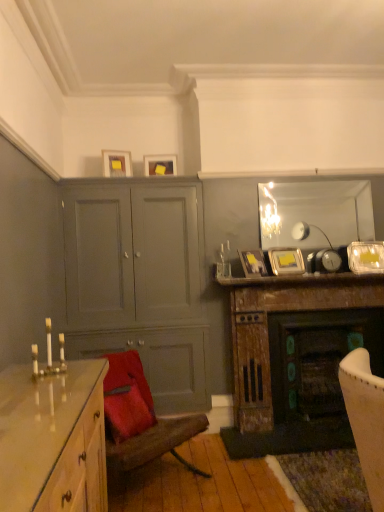
Question: Is metallic silver picture frame at upper right, which ranks as the fifth picture frame in left-to-right order, in front of matte yellow picture frame at upper center, which is the first picture frame in left-to-right order?

Choices:
 (A) yes
 (B) no

Answer: (A)

Question: From a real-world perspective, does metallic silver picture frame at upper right, the third picture frame positioned from the bottom, stand above matte yellow picture frame at upper center, which is the first picture frame in top-to-bottom order?

Choices:
 (A) no
 (B) yes

Answer: (A)

Question: Considering the relative sizes of metallic silver picture frame at upper right, the third picture frame positioned from the bottom, and matte yellow picture frame at upper center, placed as the 5th picture frame when sorted from right to left, in the image provided, is metallic silver picture frame at upper right, the third picture frame positioned from the bottom, bigger than matte yellow picture frame at upper center, placed as the 5th picture frame when sorted from right to left,?

Choices:
 (A) yes
 (B) no

Answer: (A)

Question: Is metallic silver picture frame at upper right, the third picture frame positioned from the bottom, thinner than matte yellow picture frame at upper center, placed as the 5th picture frame when sorted from right to left?

Choices:
 (A) no
 (B) yes

Answer: (B)

Question: From the image's perspective, is metallic silver picture frame at upper right, which is counted as the third picture frame, starting from the top, beneath matte yellow picture frame at upper center, placed as the 5th picture frame when sorted from right to left?

Choices:
 (A) yes
 (B) no

Answer: (A)

Question: Considering the relative positions of gold metallic candle holder at left and matte gray cabinet at center-left in the image provided, is gold metallic candle holder at left to the left or to the right of matte gray cabinet at center-left?

Choices:
 (A) right
 (B) left

Answer: (B)

Question: From a real-world perspective, relative to matte gray cabinet at center-left, is gold metallic candle holder at left vertically above or below?

Choices:
 (A) above
 (B) below

Answer: (B)

Question: Considering the positions of point (59, 355) and point (97, 199), is point (59, 355) closer or farther from the camera than point (97, 199)?

Choices:
 (A) closer
 (B) farther

Answer: (A)

Question: Considering the positions of gold metallic candle holder at left and matte gray cabinet at center-left in the image, is gold metallic candle holder at left taller or shorter than matte gray cabinet at center-left?

Choices:
 (A) tall
 (B) short

Answer: (B)

Question: In the image, is gold metallic candle holder at left positioned in front of or behind glossy wood chest of drawers at lower left?

Choices:
 (A) behind
 (B) front

Answer: (A)

Question: Would you say gold metallic candle holder at left is inside or outside glossy wood chest of drawers at lower left?

Choices:
 (A) outside
 (B) inside

Answer: (A)

Question: Does point (44, 322) appear closer or farther from the camera than point (99, 392)?

Choices:
 (A) closer
 (B) farther

Answer: (B)

Question: From a real-world perspective, is gold metallic candle holder at left physically located above or below glossy wood chest of drawers at lower left?

Choices:
 (A) below
 (B) above

Answer: (B)

Question: Is velvet red chair at lower left situated inside matte gray cabinet at center-left or outside?

Choices:
 (A) inside
 (B) outside

Answer: (B)

Question: Considering the positions of point (155, 421) and point (206, 361), is point (155, 421) closer or farther from the camera than point (206, 361)?

Choices:
 (A) closer
 (B) farther

Answer: (A)